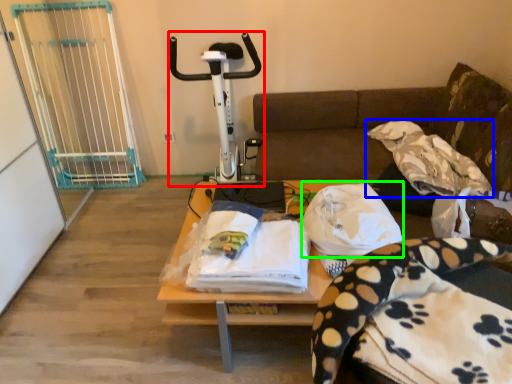
Question: Estimate the real-world distances between objects in this image. Which object is closer to sport equipment (highlighted by a red box), blanket (highlighted by a blue box) or cloth (highlighted by a green box)?

Choices:
 (A) blanket
 (B) cloth

Answer: (B)